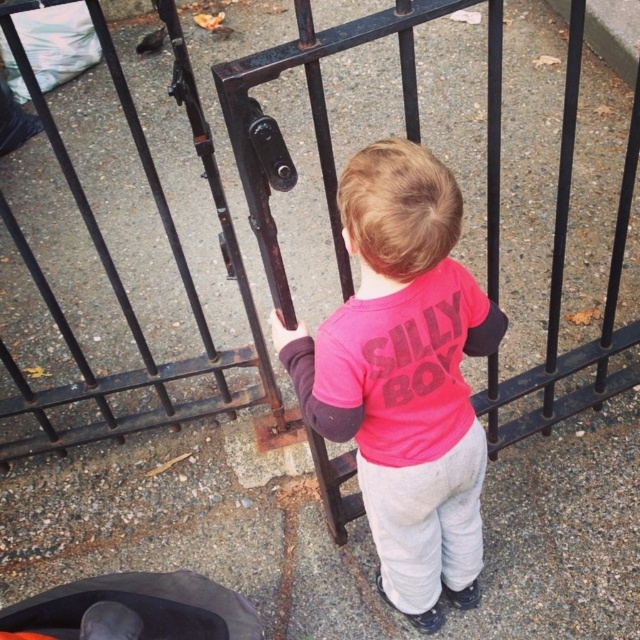
Where is the black metal gate at center located in the image?

The black metal gate at center is located at point (120,280).

You are a photographer setting up a shot of the scene. You need to ensure that the pink matte shirt at center and the black fabric baby carriage at lower left are both in focus. Given that the shirt is thinner than the carriage, which object should you adjust your camera focus on first to ensure both are sharp?

Since the pink matte shirt at center is thinner than the black fabric baby carriage at lower left, you should focus on the thinner object first, which is the pink matte shirt at center, to ensure both are in focus.

In the scene shown: You are a photographer trying to capture the child in the center of the frame. The camera you are using has a focus point at point (404, 376). Where should you aim the focus point to ensure the child is centered?

The pink matte shirt at center is located at point (404, 376), so you should aim the focus point at that coordinate to center the child.